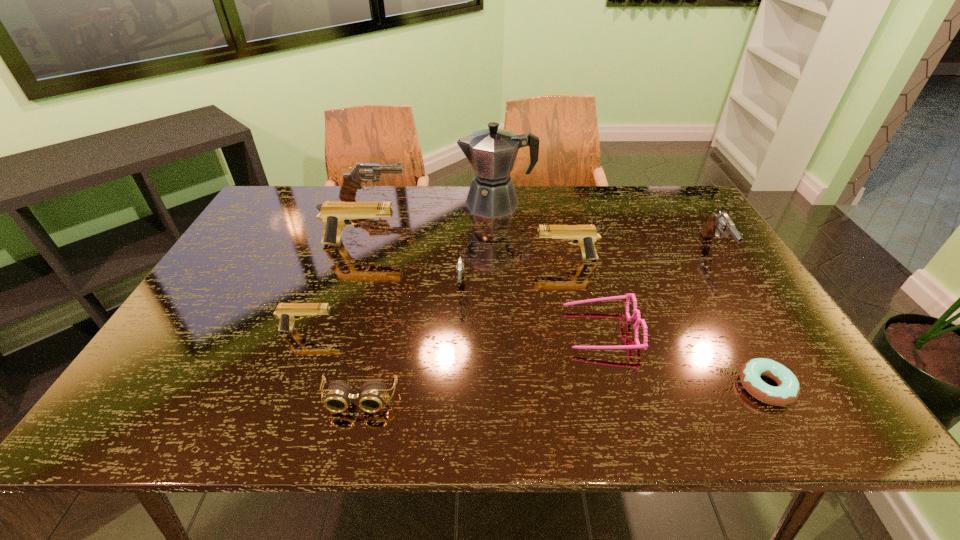
At what (x,y) coordinates should I click in order to perform the action: click on the smallest tan pistol. Please return your answer as a coordinate pair (x, y). Looking at the image, I should click on (287, 312).

I want to click on the nearest tan pistol, so click(287, 312).

Where is `spectacles`? Image resolution: width=960 pixels, height=540 pixels. spectacles is located at coordinates (636, 312).

In order to click on brown goggles in this screenshot , I will do `click(371, 397)`.

You are a GUI agent. You are given a task and a screenshot of the screen. Output one action in this format:
    pyautogui.click(x=<x>, y=<y>)
    Task: Click on the blue doughnut
    This screenshot has width=960, height=540.
    Given the screenshot: What is the action you would take?
    pyautogui.click(x=788, y=389)

Identify the location of the shortest object. Image resolution: width=960 pixels, height=540 pixels. (788, 389).

Image resolution: width=960 pixels, height=540 pixels. In order to click on vacant space located 0.360m at the spout of the coffeepot in this screenshot , I will do `click(352, 204)`.

What are the coordinates of `vacant space located at the spout of the coffeepot` in the screenshot? It's located at (396, 204).

This screenshot has height=540, width=960. In order to click on vacant space located 0.080m at the spout of the coffeepot in this screenshot , I will do `click(435, 204)`.

This screenshot has height=540, width=960. I want to click on free point located 0.220m at the barrel of the leftmost gray pistol, so click(x=470, y=201).